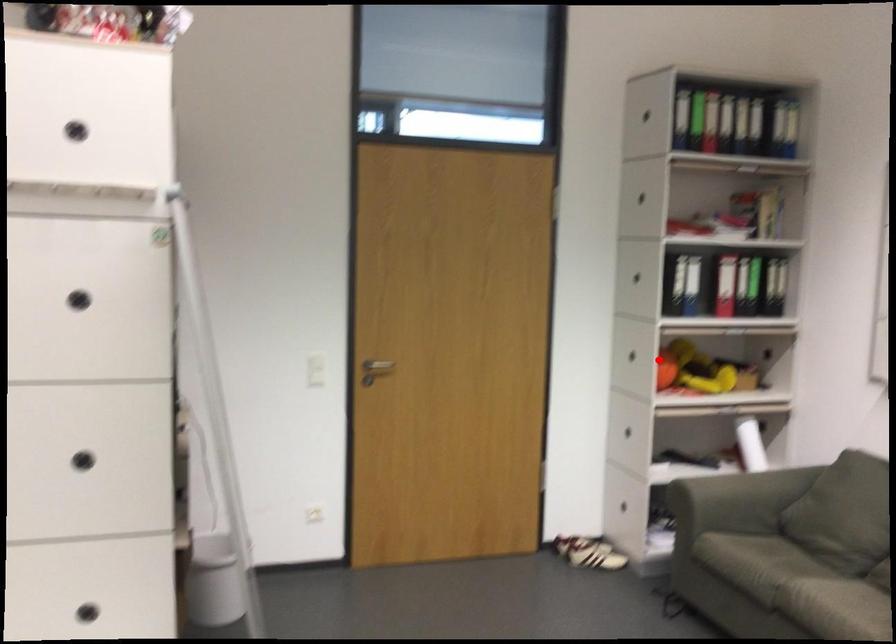
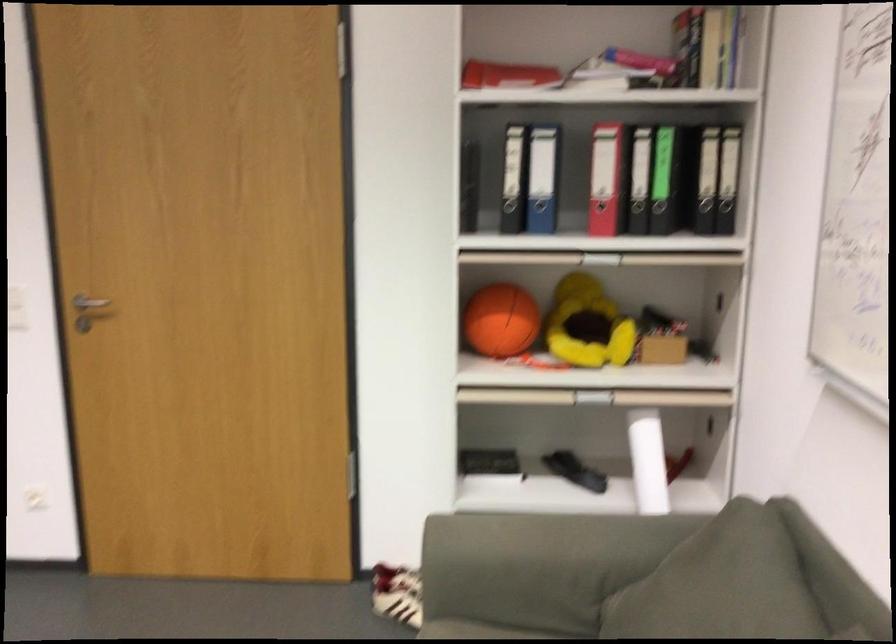
Question: A red point is marked in image1. In image2, is the corresponding 3D point closer to the camera or farther? Reply with the corresponding letter.

Choices:
 (A) The corresponding 3D point is closer.
 (B) The corresponding 3D point is farther.

Answer: (A)